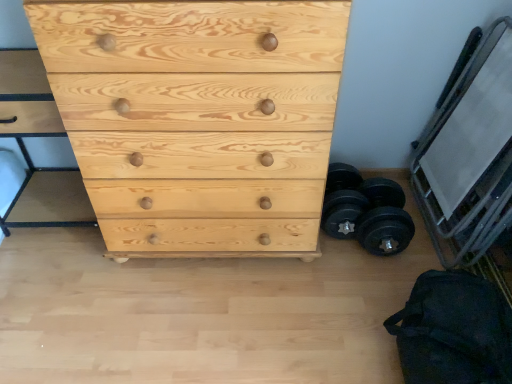
This screenshot has height=384, width=512. What are the coordinates of `natural wood chest of drawers at center` in the screenshot? It's located at (198, 119).

The width and height of the screenshot is (512, 384). What do you see at coordinates (470, 156) in the screenshot? I see `metallic silver bunk bed at right` at bounding box center [470, 156].

Find the location of `natural wood chest of drawers at center`. natural wood chest of drawers at center is located at coordinates (198, 119).

Looking at this image, measure the distance from black fabric bag at lower right to natural wood chest of drawers at center.

A distance of 26.69 inches exists between black fabric bag at lower right and natural wood chest of drawers at center.

From a real-world perspective, is black fabric bag at lower right over natural wood chest of drawers at center?

No, from a real-world perspective, black fabric bag at lower right is not on top of natural wood chest of drawers at center.

How different are the orientations of black fabric bag at lower right and natural wood chest of drawers at center in degrees?

0.000611 degrees.

This screenshot has width=512, height=384. Identify the location of bag that appears on the right of natural wood chest of drawers at center. (454, 331).

Is black rubber dumbbell at lower right surrounding black fabric bag at lower right?

That's incorrect, black fabric bag at lower right is not inside black rubber dumbbell at lower right.

Is black rubber dumbbell at lower right not close to black fabric bag at lower right?

black rubber dumbbell at lower right is near black fabric bag at lower right, not far away.

How different are the orientations of black rubber dumbbell at lower right and black fabric bag at lower right in degrees?

2.57 degrees separate the facing orientations of black rubber dumbbell at lower right and black fabric bag at lower right.

How much distance is there between black rubber dumbbell at lower right and black fabric bag at lower right?

black rubber dumbbell at lower right is 16.08 inches from black fabric bag at lower right.

Between natural wood chest of drawers at center and black fabric bag at lower right, which one appears on the left side from the viewer's perspective?

natural wood chest of drawers at center is more to the left.

Between natural wood chest of drawers at center and black fabric bag at lower right, which one is positioned behind?

black fabric bag at lower right.

Where is `bag that appears below the natural wood chest of drawers at center (from a real-world perspective)`? bag that appears below the natural wood chest of drawers at center (from a real-world perspective) is located at coordinates (454, 331).

From the image's perspective, which one is positioned higher, natural wood chest of drawers at center or black fabric bag at lower right?

natural wood chest of drawers at center, from the image's perspective.

Find the location of a particular element. chest of drawers in front of the metallic silver bunk bed at right is located at coordinates point(198,119).

Looking at this image, does natural wood chest of drawers at center appear on the left side of metallic silver bunk bed at right?

Yes, natural wood chest of drawers at center is to the left of metallic silver bunk bed at right.

From a real-world perspective, is metallic silver bunk bed at right positioned above or below black rubber dumbbell at lower right?

From a real-world perspective, metallic silver bunk bed at right is physically above black rubber dumbbell at lower right.

Based on the photo, is metallic silver bunk bed at right surrounding black rubber dumbbell at lower right?

No, black rubber dumbbell at lower right is located outside of metallic silver bunk bed at right.

You are a GUI agent. You are given a task and a screenshot of the screen. Output one action in this format:
    pyautogui.click(x=<x>, y=<y>)
    Task: Click on the bunk bed above the black rubber dumbbell at lower right (from a real-world perspective)
    
    Given the screenshot: What is the action you would take?
    pyautogui.click(x=470, y=156)

Between metallic silver bunk bed at right and black rubber dumbbell at lower right, which one appears on the left side from the viewer's perspective?

From the viewer's perspective, black rubber dumbbell at lower right appears more on the left side.

Is black rubber dumbbell at lower right closer to the viewer compared to metallic silver bunk bed at right?

No.

Can you tell me how much black rubber dumbbell at lower right and metallic silver bunk bed at right differ in facing direction?

87.4 degrees.

Is black rubber dumbbell at lower right directly adjacent to metallic silver bunk bed at right?

black rubber dumbbell at lower right and metallic silver bunk bed at right are clearly separated.

Can you confirm if black rubber dumbbell at lower right is thinner than metallic silver bunk bed at right?

In fact, black rubber dumbbell at lower right might be wider than metallic silver bunk bed at right.

From a real-world perspective, which is physically above, black fabric bag at lower right or metallic silver bunk bed at right?

From a 3D spatial view, metallic silver bunk bed at right is above.

Would you say black fabric bag at lower right is to the left or to the right of metallic silver bunk bed at right in the picture?

black fabric bag at lower right is positioned on metallic silver bunk bed at right's left side.

Can you confirm if black fabric bag at lower right is bigger than metallic silver bunk bed at right?

No, black fabric bag at lower right is not bigger than metallic silver bunk bed at right.

Locate an element on the screen. chest of drawers in front of the black fabric bag at lower right is located at coordinates (198, 119).

Locate an element on the screen. The width and height of the screenshot is (512, 384). bag below the black rubber dumbbell at lower right (from the image's perspective) is located at coordinates (454, 331).

From the picture: From the image, which object appears to be farther from black fabric bag at lower right, metallic silver bunk bed at right or natural wood chest of drawers at center?

Among the two, natural wood chest of drawers at center is located further to black fabric bag at lower right.

Estimate the real-world distances between objects in this image. Which object is closer to natural wood chest of drawers at center, black rubber dumbbell at lower right or black fabric bag at lower right?

The object closer to natural wood chest of drawers at center is black rubber dumbbell at lower right.

Estimate the real-world distances between objects in this image. Which object is further from black fabric bag at lower right, black rubber dumbbell at lower right or natural wood chest of drawers at center?

Among the two, natural wood chest of drawers at center is located further to black fabric bag at lower right.

From the image, which object appears to be farther from black rubber dumbbell at lower right, black fabric bag at lower right or natural wood chest of drawers at center?

natural wood chest of drawers at center lies further to black rubber dumbbell at lower right than the other object.

Based on their spatial positions, is metallic silver bunk bed at right or black fabric bag at lower right further from natural wood chest of drawers at center?

Among the two, metallic silver bunk bed at right is located further to natural wood chest of drawers at center.

Based on their spatial positions, is black fabric bag at lower right or black rubber dumbbell at lower right closer to natural wood chest of drawers at center?

black rubber dumbbell at lower right is positioned closer to the anchor natural wood chest of drawers at center.

When comparing their distances from black rubber dumbbell at lower right, does natural wood chest of drawers at center or metallic silver bunk bed at right seem further?

Based on the image, natural wood chest of drawers at center appears to be further to black rubber dumbbell at lower right.

Estimate the real-world distances between objects in this image. Which object is further from metallic silver bunk bed at right, black rubber dumbbell at lower right or black fabric bag at lower right?

black fabric bag at lower right is further to metallic silver bunk bed at right.

Locate an element on the screen. The width and height of the screenshot is (512, 384). dumbbell between metallic silver bunk bed at right and black fabric bag at lower right from top to bottom is located at coordinates (366, 211).

Where is `dumbbell situated between natural wood chest of drawers at center and metallic silver bunk bed at right from left to right`? dumbbell situated between natural wood chest of drawers at center and metallic silver bunk bed at right from left to right is located at coordinates (366, 211).

Locate an element on the screen. dumbbell located between natural wood chest of drawers at center and black fabric bag at lower right in the left-right direction is located at coordinates (366, 211).

What are the coordinates of `bag located between natural wood chest of drawers at center and metallic silver bunk bed at right in the left-right direction` in the screenshot? It's located at (454, 331).